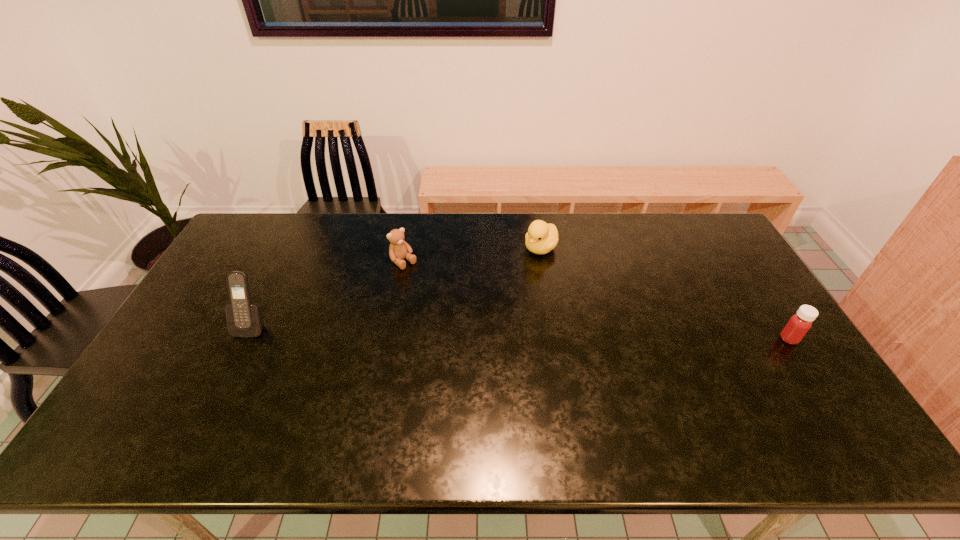
Locate an element on the screen. free spot on the desktop that is between the leftmost object and the rightmost object and is positioned on the front-facing side of the third object from left to right is located at coordinates (459, 330).

Locate an element on the screen. The width and height of the screenshot is (960, 540). vacant space on the desktop that is between the cellular telephone and the rightmost object and is positioned on the face of the teddy bear is located at coordinates (479, 331).